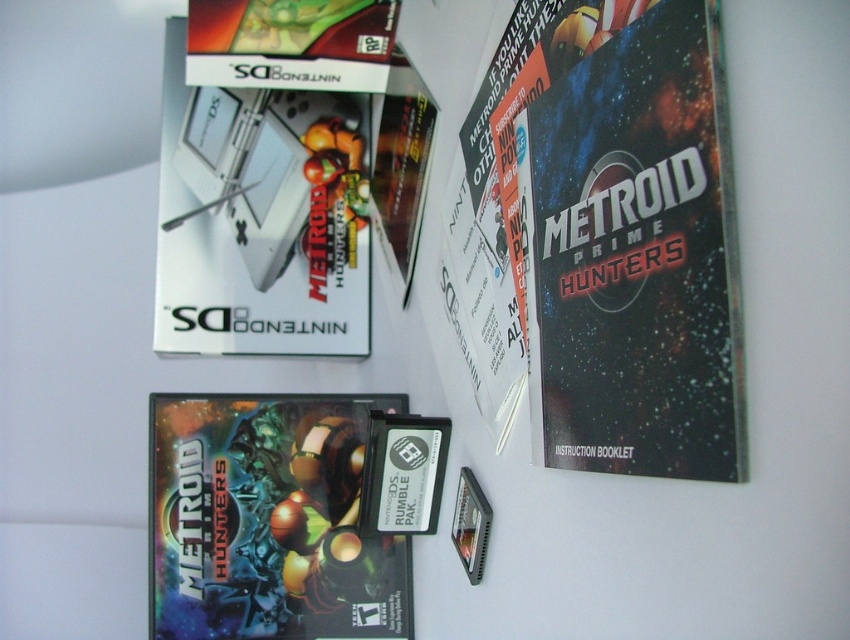
You are organizing a display for a Metroid Prime Hunters memorabilia collection. You need to place the metallic silver instruction booklet at upper right and the white glossy nintendo ds at upper left on a shelf. Which item has a smaller width and should be placed in a more compact space?

The metallic silver instruction booklet at upper right has a smaller width than the white glossy nintendo ds at upper left, so it should be placed in a more compact space.

What is located at the coordinates point (636, 256) in the image?

The metallic silver instruction booklet at upper right is located at point (636, 256).